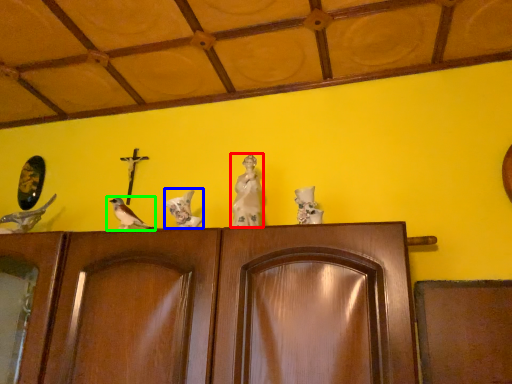
Question: Which is farther away from sculpture (highlighted by a red box)? bird (highlighted by a blue box) or bird (highlighted by a green box)?

Choices:
 (A) bird
 (B) bird

Answer: (B)